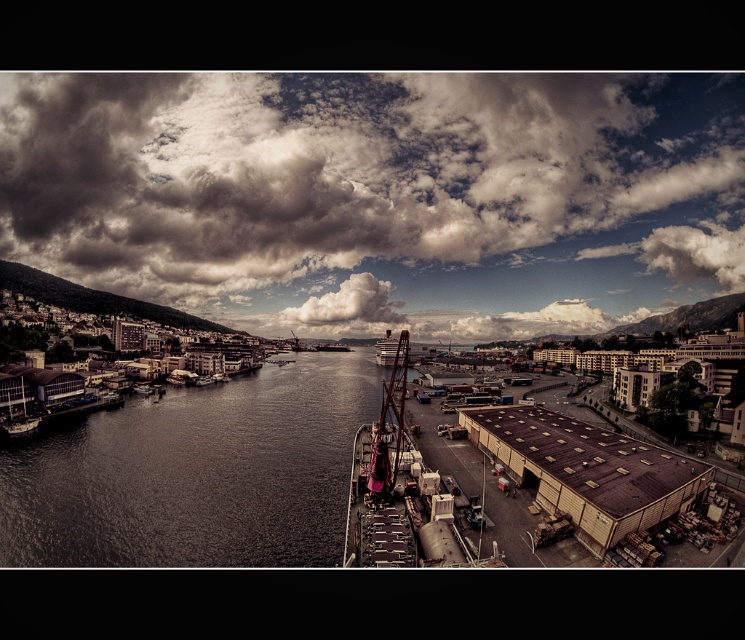
You are standing at the elevated vantage point overlooking the harbor. You need to locate the dark brown water at center. Based on the coordinates provided, where exactly would you find it?

The dark brown water at center is located at point coordinates (196, 474).

You are a delivery truck driver who needs to unload cargo onto the brown corrugated metal dock at lower right. You observe the dark brown water at center from your truck. Which object is higher in elevation?

The brown corrugated metal dock at lower right is taller than the dark brown water at center, so the dock is higher in elevation.